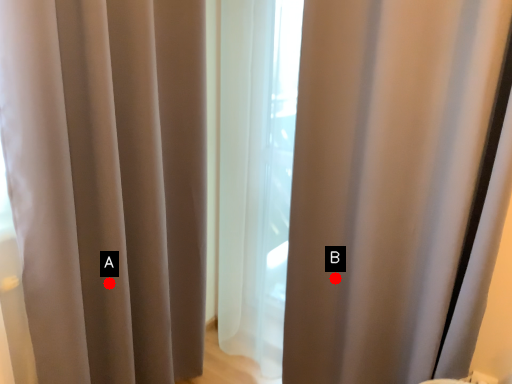
Question: Two points are circled on the image, labeled by A and B beside each circle. Which of the following is the closest to the observer?

Choices:
 (A) A is closer
 (B) B is closer

Answer: (A)